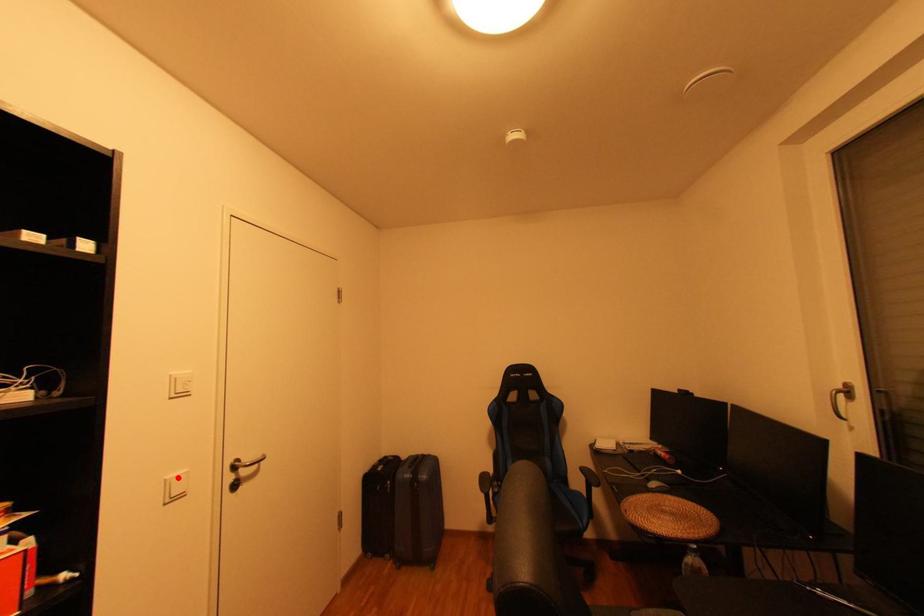
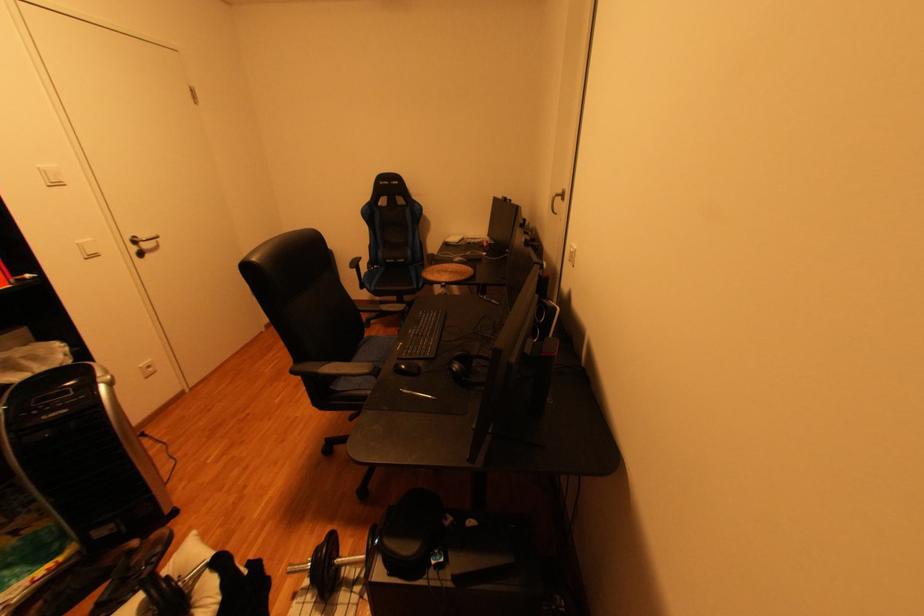
In the second image, find the point that corresponds to the highlighted location in the first image.

(89, 243)